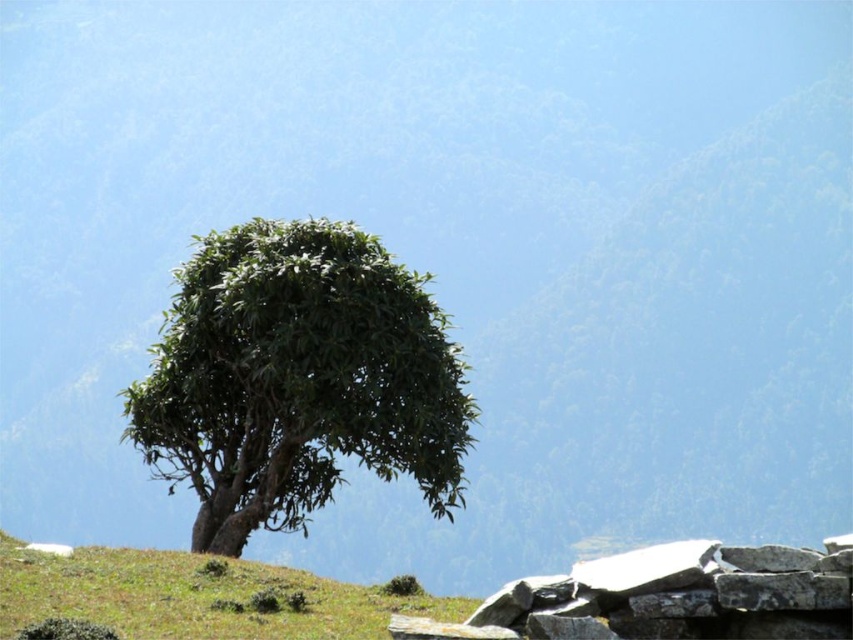
Question: Which point is closer to the camera?

Choices:
 (A) green leafy tree at center
 (B) green grassy at lower left

Answer: (B)

Question: Does green leafy tree at center come behind green grassy at lower left?

Choices:
 (A) yes
 (B) no

Answer: (A)

Question: Can you confirm if green leafy tree at center is positioned below green grassy at lower left?

Choices:
 (A) no
 (B) yes

Answer: (A)

Question: Which object appears closest to the camera in this image?

Choices:
 (A) green grassy at lower left
 (B) green leafy tree at center

Answer: (A)

Question: Is green leafy tree at center positioned before green grassy at lower left?

Choices:
 (A) yes
 (B) no

Answer: (B)

Question: Which point is farther to the camera?

Choices:
 (A) green grassy at lower left
 (B) green leafy tree at center

Answer: (B)